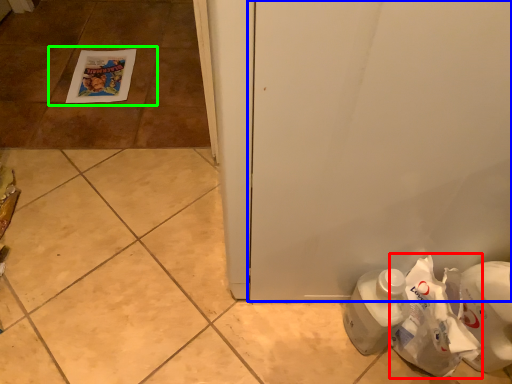
Question: Which object is the closest to the paper bag (highlighted by a red box)? Choose among these: door (highlighted by a blue box) or tile (highlighted by a green box).

Choices:
 (A) door
 (B) tile

Answer: (A)